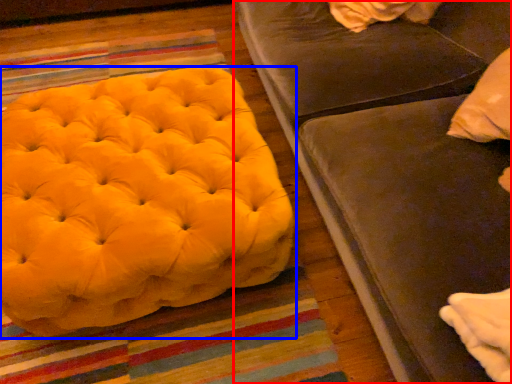
Question: Which object is further to the camera taking this photo, studio couch (highlighted by a red box) or furniture (highlighted by a blue box)?

Choices:
 (A) studio couch
 (B) furniture

Answer: (B)